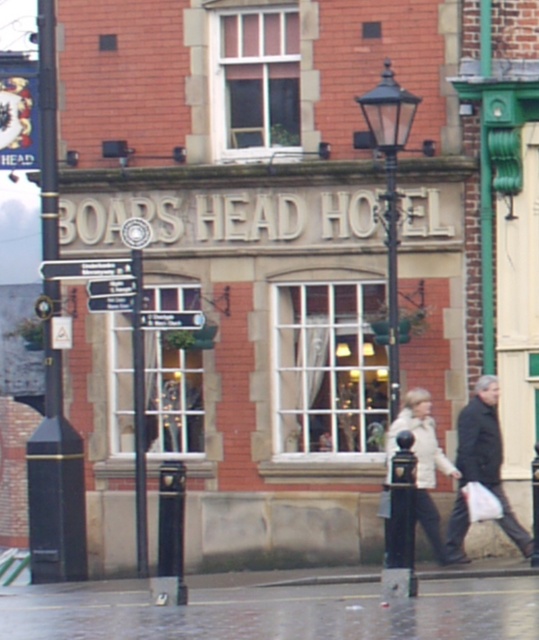
Question: Among these points, which one is nearest to the camera?

Choices:
 (A) (495, 394)
 (B) (452, 593)
 (C) (445, 561)

Answer: (B)

Question: Among these points, which one is nearest to the camera?

Choices:
 (A) (443, 454)
 (B) (46, 433)
 (C) (103, 600)
 (D) (489, 460)

Answer: (C)

Question: Is concrete pavement at lower center smaller than white matte jacket at center?

Choices:
 (A) no
 (B) yes

Answer: (A)

Question: Which is nearer to the white matte jacket at center?

Choices:
 (A) black metal pole at left
 (B) dark gray jacket at lower right
 (C) concrete pavement at lower center

Answer: (B)

Question: Can you confirm if concrete pavement at lower center is wider than black metal pole at left?

Choices:
 (A) no
 (B) yes

Answer: (B)

Question: Can you confirm if concrete pavement at lower center is positioned above black metal pole at left?

Choices:
 (A) no
 (B) yes

Answer: (A)